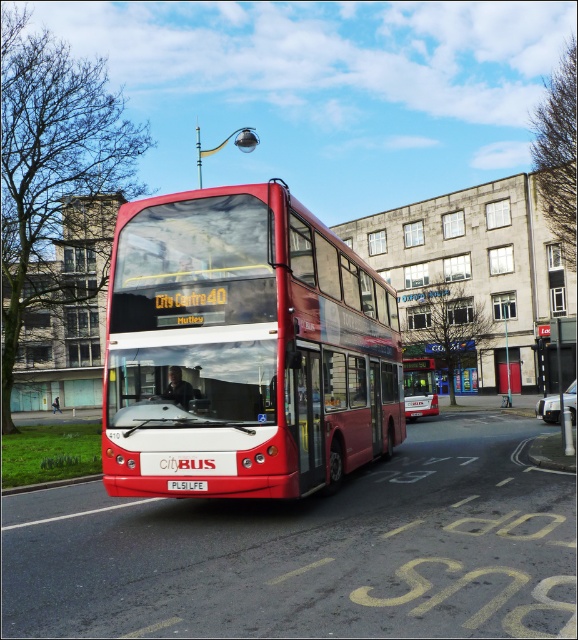
You are a pedestrian standing at the bus stop and see both the shiny red bus at center and the matte red bus at center. Which one appears closer to you?

The shiny red bus at center appears closer to you because it is positioned nearer than the matte red bus at center.

You are a delivery person who needs to load a package onto a truck that has a height limit of 2 meters. You see the matte red bus at center and the white plastic license plate at center in the scene. Which object is taller than the height limit?

The matte red bus at center is much taller than the white plastic license plate at center, so the matte red bus at center is taller than the height limit of 2 meters.

You are a city planner analyzing traffic patterns. Based on the image, what are the coordinates of the shiny red bus at center?

The coordinates of the shiny red bus at center are at point (243,348).